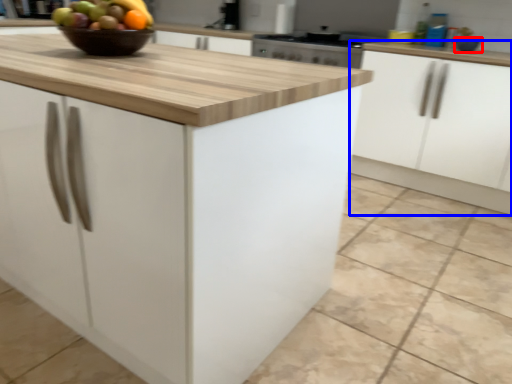
Question: Which object is further to the camera taking this photo, bowl (highlighted by a red box) or cabinetry (highlighted by a blue box)?

Choices:
 (A) bowl
 (B) cabinetry

Answer: (A)